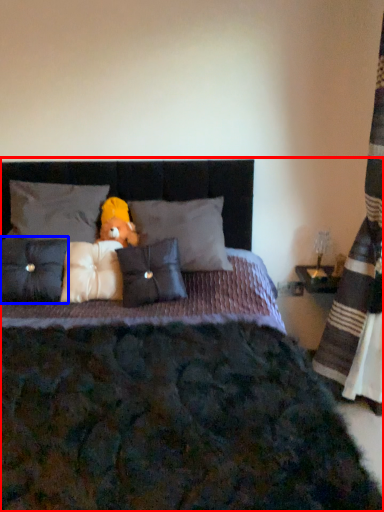
Question: Which point is closer to the camera, bed (highlighted by a red box) or pillow (highlighted by a blue box)?

Choices:
 (A) bed
 (B) pillow

Answer: (A)